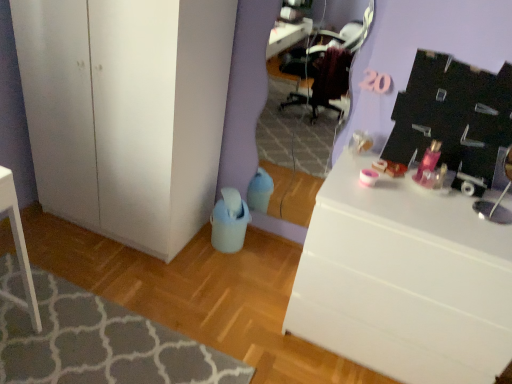
The height and width of the screenshot is (384, 512). I want to click on vacant region above white glossy desk at right (from a real-world perspective), so click(x=418, y=194).